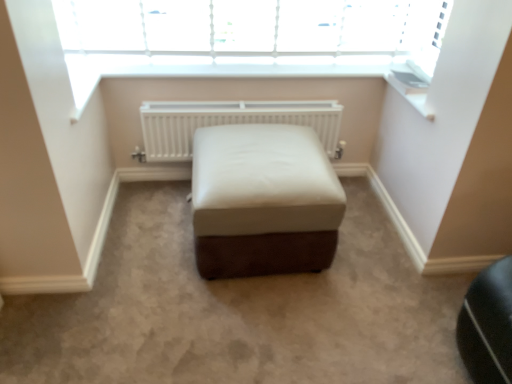
Where is `vacant space positioned to the left of white leather ottoman at center`? vacant space positioned to the left of white leather ottoman at center is located at coordinates (143, 246).